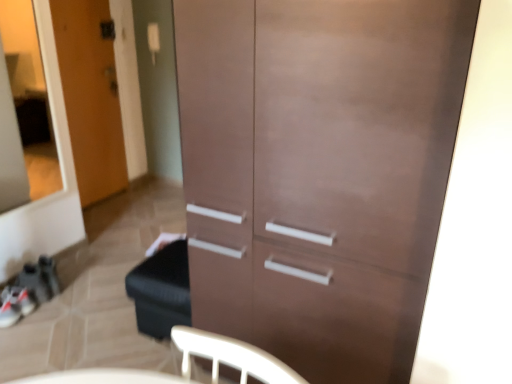
Question: Considering the relative sizes of matte brown cabinet at center and transparent glass door at upper left in the image provided, is matte brown cabinet at center wider than transparent glass door at upper left?

Choices:
 (A) no
 (B) yes

Answer: (B)

Question: Is transparent glass door at upper left inside matte brown cabinet at center?

Choices:
 (A) yes
 (B) no

Answer: (B)

Question: Are matte brown cabinet at center and transparent glass door at upper left making contact?

Choices:
 (A) no
 (B) yes

Answer: (A)

Question: Is the position of matte brown cabinet at center less distant than that of transparent glass door at upper left?

Choices:
 (A) no
 (B) yes

Answer: (B)

Question: From the image's perspective, is matte brown cabinet at center below transparent glass door at upper left?

Choices:
 (A) no
 (B) yes

Answer: (B)

Question: Is point (94, 21) positioned closer to the camera than point (353, 264)?

Choices:
 (A) farther
 (B) closer

Answer: (A)

Question: Is wooden door at left in front of or behind matte brown cabinet at center in the image?

Choices:
 (A) front
 (B) behind

Answer: (B)

Question: In terms of size, does wooden door at left appear bigger or smaller than matte brown cabinet at center?

Choices:
 (A) small
 (B) big

Answer: (A)

Question: Is wooden door at left spatially inside matte brown cabinet at center, or outside of it?

Choices:
 (A) outside
 (B) inside

Answer: (A)

Question: Is transparent glass door at upper left spatially inside matte brown cabinet at center, or outside of it?

Choices:
 (A) inside
 (B) outside

Answer: (B)

Question: Looking at their shapes, would you say transparent glass door at upper left is wider or thinner than matte brown cabinet at center?

Choices:
 (A) wide
 (B) thin

Answer: (B)

Question: From a real-world perspective, is transparent glass door at upper left positioned above or below matte brown cabinet at center?

Choices:
 (A) below
 (B) above

Answer: (B)

Question: From the image's perspective, relative to matte brown cabinet at center, is transparent glass door at upper left above or below?

Choices:
 (A) above
 (B) below

Answer: (A)

Question: Considering their positions, is matte brown cabinet at center located in front of or behind transparent glass door at upper left?

Choices:
 (A) front
 (B) behind

Answer: (A)

Question: In terms of height, does matte brown cabinet at center look taller or shorter compared to transparent glass door at upper left?

Choices:
 (A) tall
 (B) short

Answer: (A)